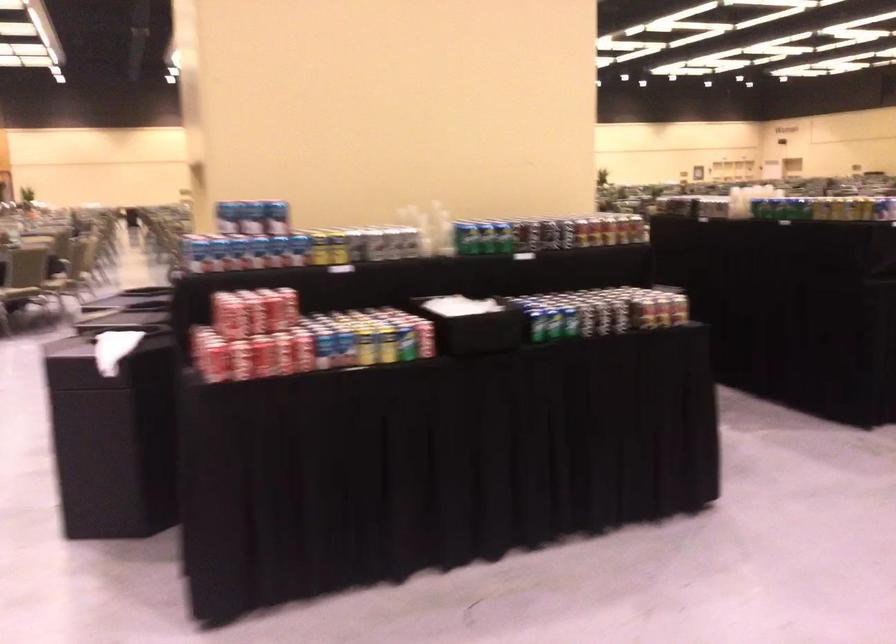
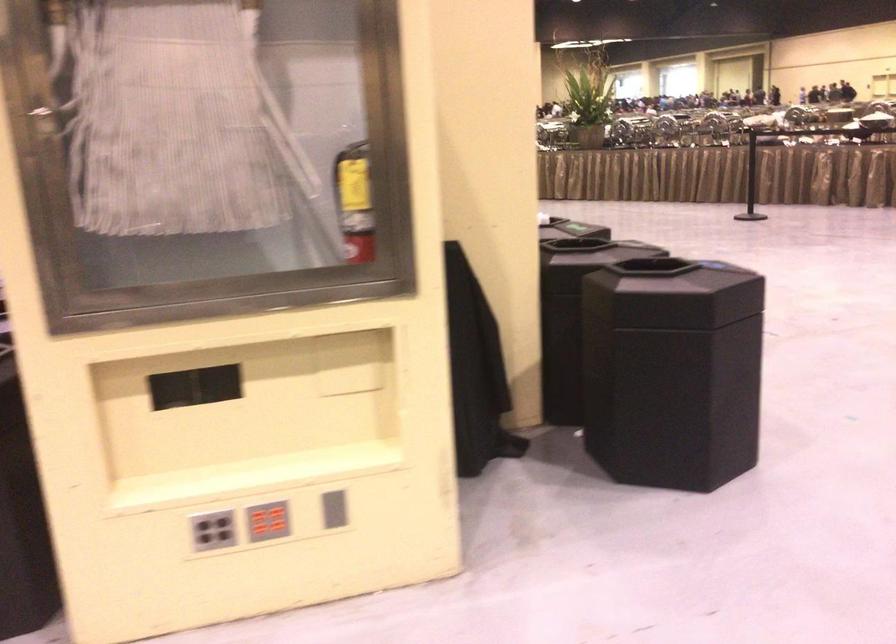
Question: I am providing you with two images of the same scene from different viewpoints. After the viewpoint changes to image2, which objects are now occluded?

Choices:
 (A) black trash can lid
 (B) white router box
 (C) grey button panel
 (D) silver soda can

Answer: (D)